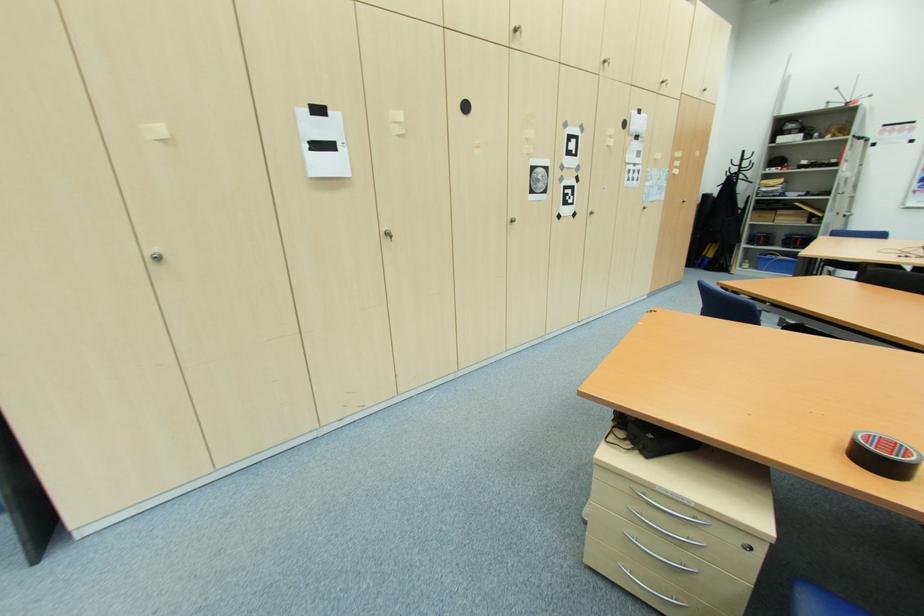
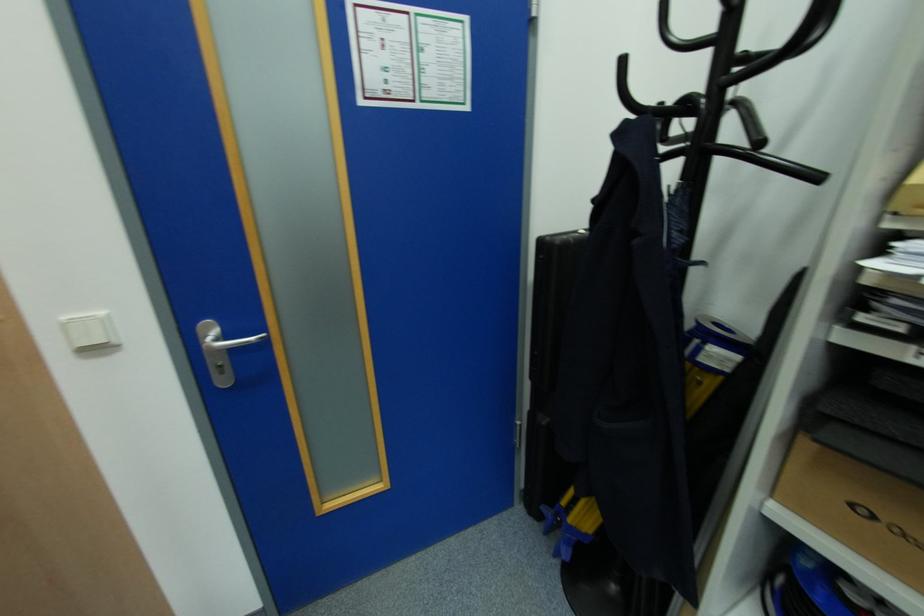
The point at [701,237] is marked in the first image. Where is the corresponding point in the second image?

(548, 421)